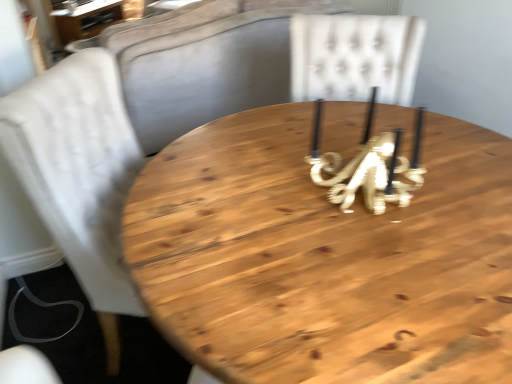
Question: From a real-world perspective, relative to wooden table at upper left, which ranks as the second table in bottom-to-top order, is natural wood table at center, which is the second table in top-to-bottom order, vertically above or below?

Choices:
 (A) below
 (B) above

Answer: (B)

Question: Do you think natural wood table at center, which is the second table in top-to-bottom order, is within wooden table at upper left, the second table when ordered from right to left, or outside of it?

Choices:
 (A) inside
 (B) outside

Answer: (B)

Question: Which object is the farthest from the white fabric chair at left?

Choices:
 (A) wooden table at upper left, which is the 1th table in back-to-front order
 (B) natural wood table at center, which is the first table from right to left

Answer: (A)

Question: Which of these objects is positioned closest to the wooden table at upper left, which ranks as the second table in bottom-to-top order?

Choices:
 (A) white fabric chair at left
 (B) natural wood table at center, which appears as the 1th table when viewed from the front

Answer: (A)